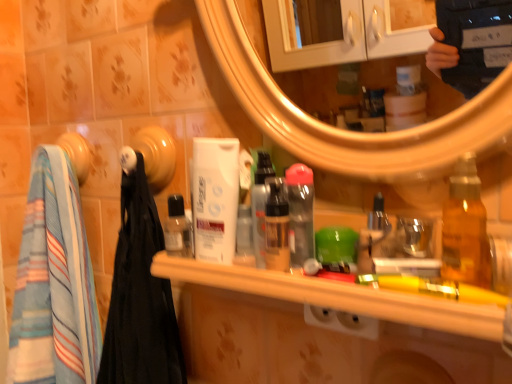
Locate an element on the screen. blank space situated above wooden shelf at center (from a real-world perspective) is located at coordinates (338, 268).